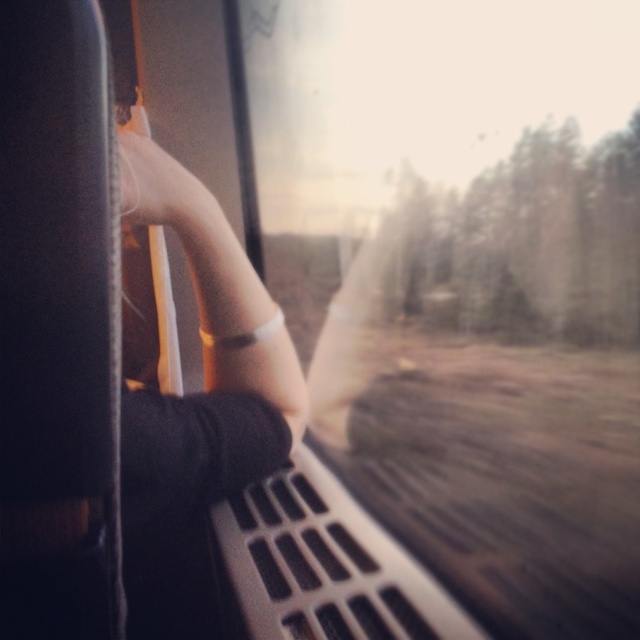
You are a passenger sitting in the train and want to see the view outside through the transparent glass train window at center. However, your matte white hand at upper left is blocking part of the window. Can you move your hand to the side to fully see the view?

The transparent glass train window at center is taller than the matte white hand at upper left, so moving your hand to the side would allow you to fully see the view through the transparent glass train window at center.

You are a passenger on the train and want to wave to someone outside. You have your matte white hand at upper left and the transparent glass train window at center. Which object is closer to you when you try to reach out the window?

The matte white hand at upper left is closer to you than the transparent glass train window at center because the hand is part of your body, while the window is an object in the scene.